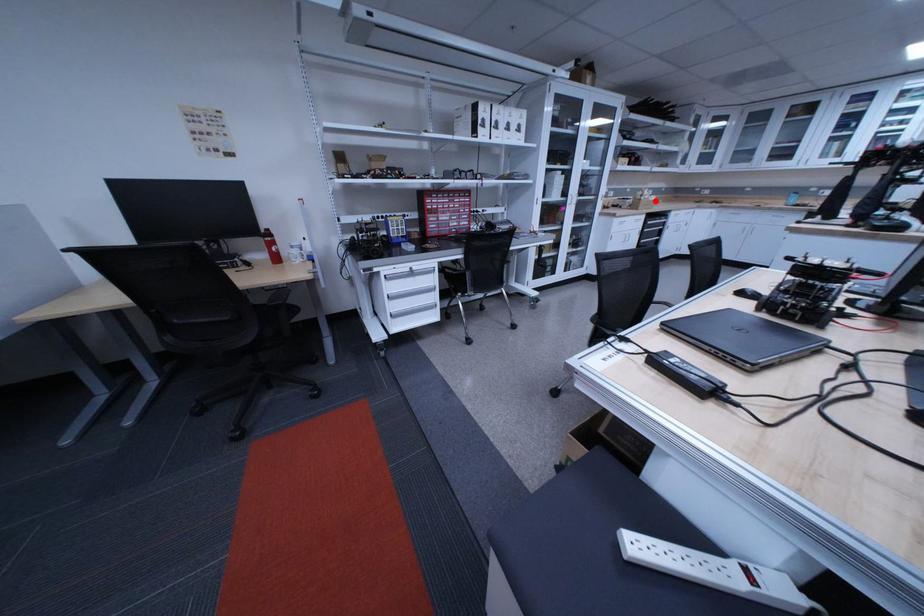
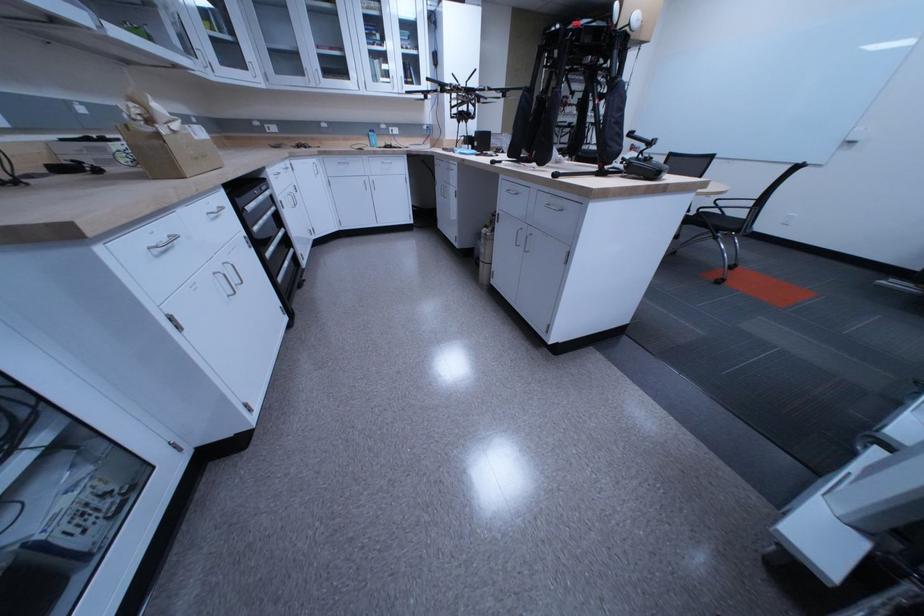
Question: I am providing you with two images of the same scene from different viewpoints. Image1 has a red point marked. In image2, the corresponding 3D location appears at what relative position? Reply with the corresponding letter.

Choices:
 (A) Closer
 (B) Farther

Answer: (B)